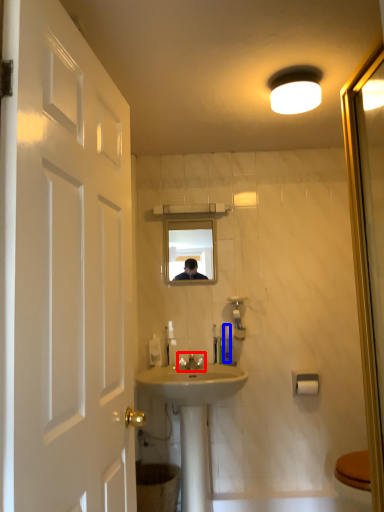
Question: Which point is closer to the camera, tap (highlighted by a red box) or toiletry (highlighted by a blue box)?

Choices:
 (A) tap
 (B) toiletry

Answer: (A)